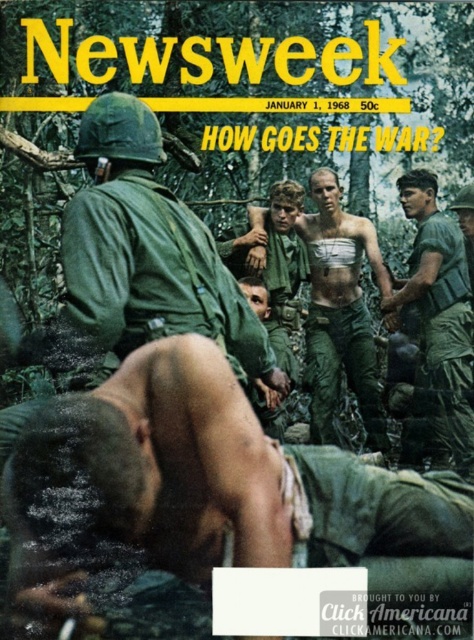
You are a photographer analyzing the Newsweek cover from January 1, 1968. You notice two points marked on the image. Which point is closer to the camera, point at coordinates [365,256] or point at coordinates [428,378]?

Point at coordinates [365,256] is closer to the camera than point at coordinates [428,378] because it is further to the camera than the other point.

You are a photographer standing at the camera position. The skinny man at center is your subject. Can you capture him in a single frame without moving the camera? The maximum distance your camera can focus is 40 feet.

The skinny man at center is 42.16 feet away from the camera, which exceeds the camera focus limit of 40 feet. Therefore, you cannot capture him in a single frame without moving the camera.